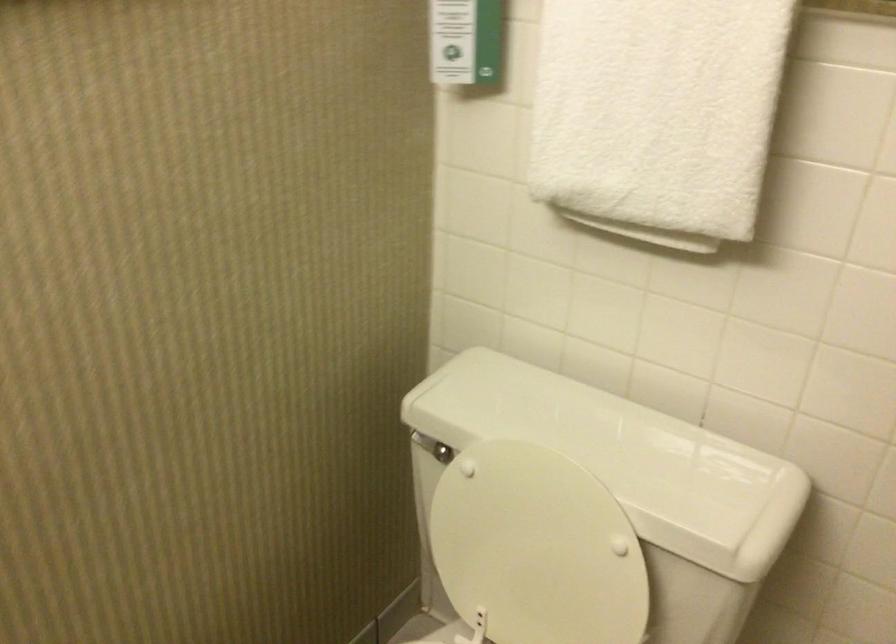
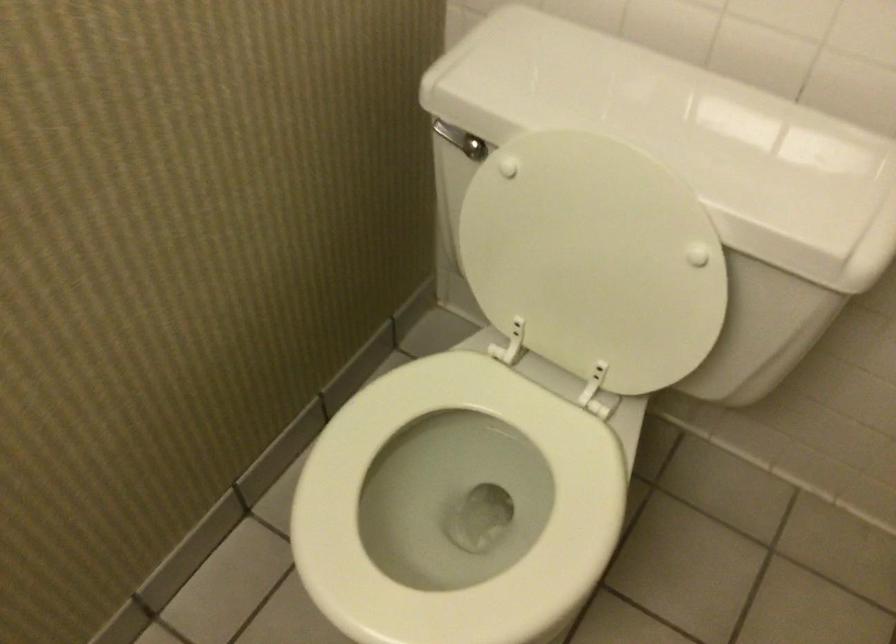
Question: How did the camera likely rotate?

Choices:
 (A) Left
 (B) Right
 (C) Up
 (D) Down

Answer: (D)